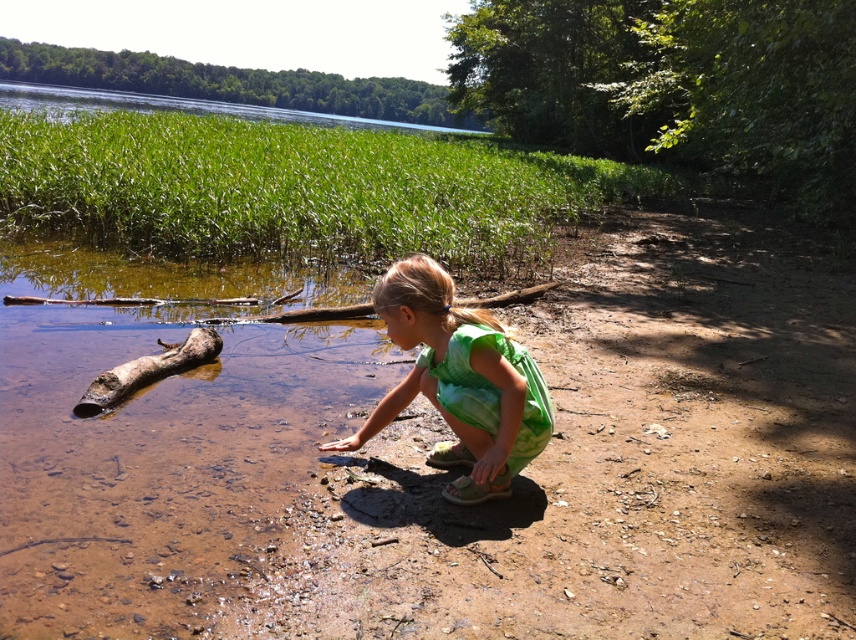
Question: Can you confirm if brown sandy soil at lower center is wider than brown rough log at left?

Choices:
 (A) yes
 (B) no

Answer: (A)

Question: Which point is farther to the camera?

Choices:
 (A) (483, 372)
 (B) (111, 378)
 (C) (834, 346)

Answer: (C)

Question: Which of these objects is positioned closest to the brown rough log at left?

Choices:
 (A) green grass at upper center
 (B) green tie-dye dress at center

Answer: (B)

Question: Is brown sandy soil at lower center to the left of brown rough log at left from the viewer's perspective?

Choices:
 (A) yes
 (B) no

Answer: (B)

Question: Which point is farther to the camera?

Choices:
 (A) (381, 304)
 (B) (192, 339)
 (C) (484, 131)

Answer: (C)

Question: Does green tie-dye dress at center have a larger size compared to brown rough log at left?

Choices:
 (A) yes
 (B) no

Answer: (A)